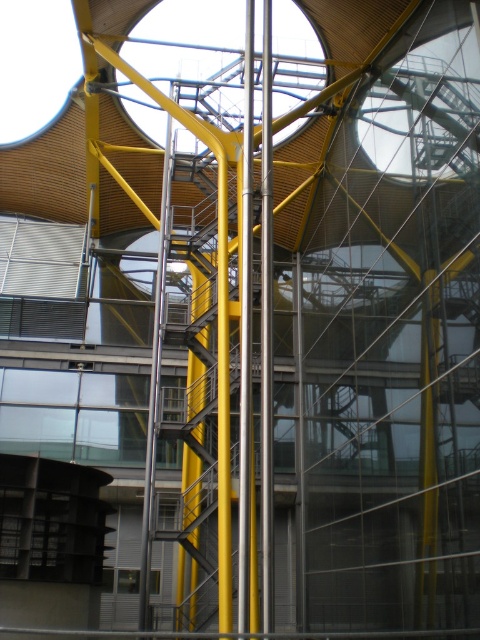
Question: Can you confirm if polished metal pole at center is positioned above metallic yellow pole at center?

Choices:
 (A) no
 (B) yes

Answer: (B)

Question: Which of the following is the farthest from the observer?

Choices:
 (A) (153, 424)
 (B) (245, 544)

Answer: (A)

Question: Which point is closer to the camera taking this photo?

Choices:
 (A) (166, 173)
 (B) (242, 342)

Answer: (B)

Question: Can you confirm if polished metal pole at center is thinner than metallic yellow pole at center?

Choices:
 (A) yes
 (B) no

Answer: (A)

Question: Is polished metal pole at center below metallic yellow pole at center?

Choices:
 (A) no
 (B) yes

Answer: (A)

Question: Which of the following is the closest to the observer?

Choices:
 (A) metallic yellow pole at center
 (B) polished metal pole at center

Answer: (B)